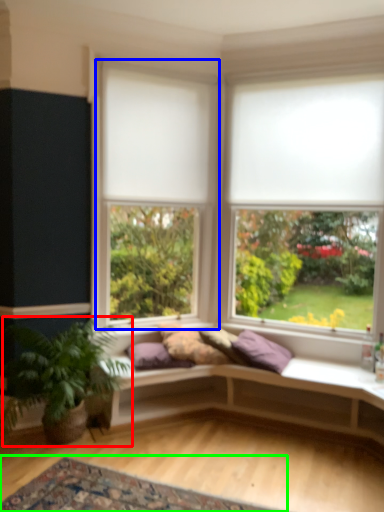
Question: Which is farther away from houseplant (highlighted by a red box)? window (highlighted by a blue box) or mat (highlighted by a green box)?

Choices:
 (A) window
 (B) mat

Answer: (A)